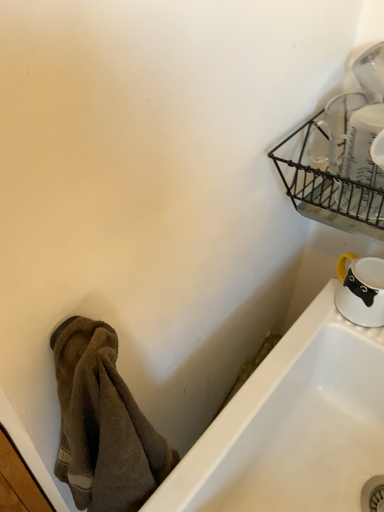
Question: From a real-world perspective, is white glossy mug at lower right, the 2th tableware when ordered from top to bottom, positioned under white glossy bathtub at lower right based on gravity?

Choices:
 (A) yes
 (B) no

Answer: (B)

Question: Can you confirm if white glossy mug at lower right, the 2th tableware when ordered from top to bottom, is taller than white glossy bathtub at lower right?

Choices:
 (A) yes
 (B) no

Answer: (B)

Question: Is white glossy mug at lower right, the 2th tableware when ordered from top to bottom, positioned with its back to white glossy bathtub at lower right?

Choices:
 (A) no
 (B) yes

Answer: (A)

Question: Considering the relative sizes of white glossy mug at lower right, which is the 1th tableware in back-to-front order, and white glossy bathtub at lower right in the image provided, is white glossy mug at lower right, which is the 1th tableware in back-to-front order, bigger than white glossy bathtub at lower right?

Choices:
 (A) yes
 (B) no

Answer: (B)

Question: Could you tell me if white glossy mug at lower right, arranged as the 2th tableware when viewed from the front, is facing white glossy bathtub at lower right?

Choices:
 (A) yes
 (B) no

Answer: (B)

Question: In the image, is white glossy bathtub at lower right positioned in front of or behind white glossy mug at lower right, the 2th tableware when ordered from top to bottom?

Choices:
 (A) front
 (B) behind

Answer: (A)

Question: From the image's perspective, is white glossy bathtub at lower right located above or below white glossy mug at lower right, which is the 1th tableware in back-to-front order?

Choices:
 (A) below
 (B) above

Answer: (A)

Question: Is white glossy bathtub at lower right bigger or smaller than white glossy mug at lower right, acting as the first tableware starting from the bottom?

Choices:
 (A) big
 (B) small

Answer: (A)

Question: Choose the correct answer: Is white glossy bathtub at lower right inside white glossy mug at lower right, the 2th tableware when ordered from top to bottom, or outside it?

Choices:
 (A) inside
 (B) outside

Answer: (B)

Question: In the image, is white glossy bathtub at lower right positioned in front of or behind clear glass measuring cups at upper right, which appears as the first tableware when viewed from the front?

Choices:
 (A) behind
 (B) front

Answer: (A)

Question: Is white glossy bathtub at lower right wider or thinner than clear glass measuring cups at upper right, which ranks as the 2th tableware in bottom-to-top order?

Choices:
 (A) wide
 (B) thin

Answer: (A)

Question: From the image's perspective, is white glossy bathtub at lower right above or below clear glass measuring cups at upper right, which appears as the first tableware when viewed from the front?

Choices:
 (A) below
 (B) above

Answer: (A)

Question: Considering the positions of white glossy bathtub at lower right and clear glass measuring cups at upper right, which ranks as the 2th tableware in bottom-to-top order, in the image, is white glossy bathtub at lower right bigger or smaller than clear glass measuring cups at upper right, which ranks as the 2th tableware in bottom-to-top order,?

Choices:
 (A) small
 (B) big

Answer: (B)

Question: In the image, is clear glass measuring cups at upper right, which ranks as the 2th tableware in back-to-front order, on the left side or the right side of white glossy mug at lower right, acting as the first tableware starting from the bottom?

Choices:
 (A) left
 (B) right

Answer: (A)

Question: Is clear glass measuring cups at upper right, which ranks as the 2th tableware in back-to-front order, inside the boundaries of white glossy mug at lower right, which is the 1th tableware in back-to-front order, or outside?

Choices:
 (A) inside
 (B) outside

Answer: (B)